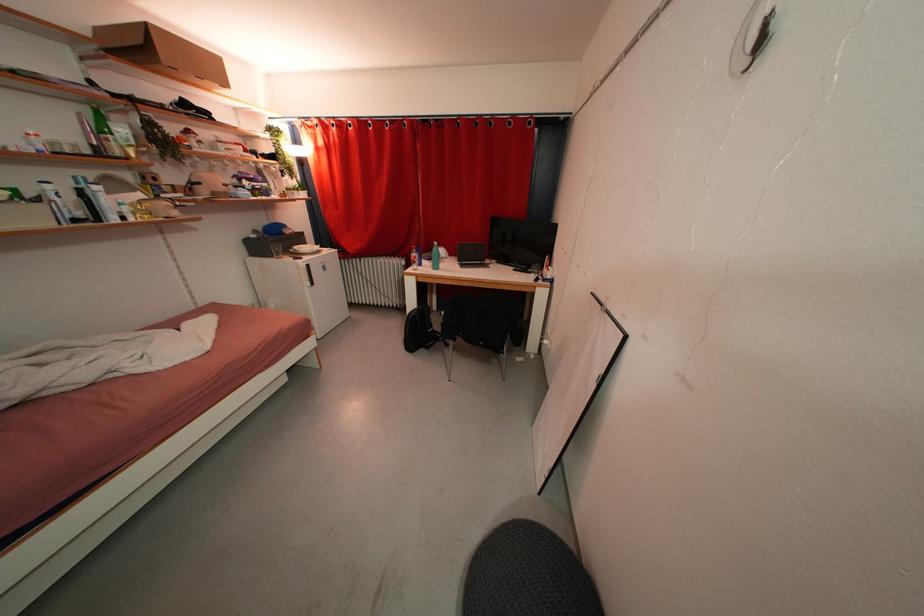
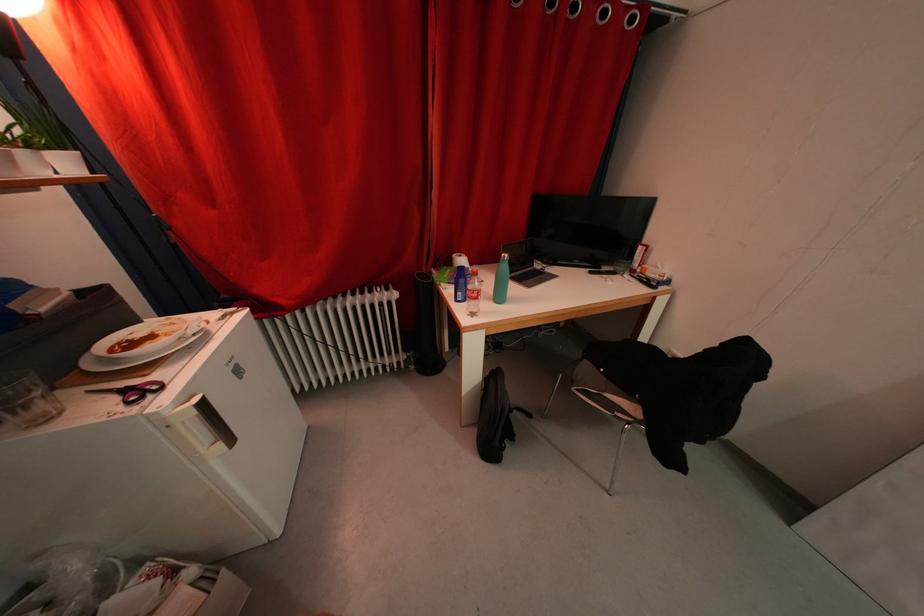
Where in the second image is the point corresponding to point 313,270 from the first image?

(209, 408)